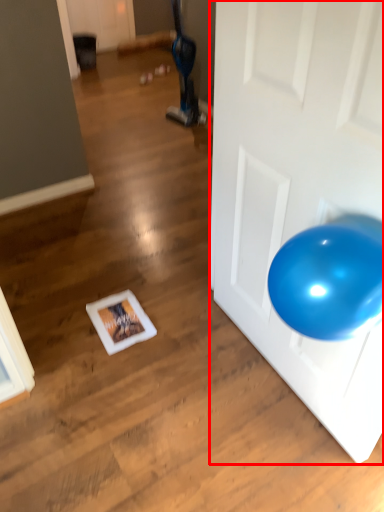
Question: From the image's perspective, what is the correct spatial relationship of door (annotated by the red box) in relation to bean bag chair?

Choices:
 (A) above
 (B) below

Answer: (B)